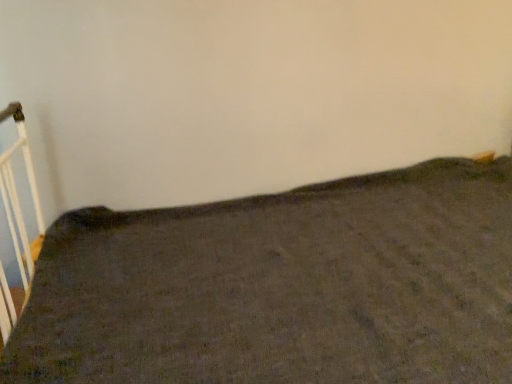
Measure the distance between point (29, 354) and camera.

Point (29, 354) and camera are 33.07 inches apart from each other.

At what (x,y) coordinates should I click in order to perform the action: click on dark fabric bed at center. Please return your answer as a coordinate pair (x, y). This screenshot has height=384, width=512. Looking at the image, I should click on (282, 287).

Describe the element at coordinates (282, 287) in the screenshot. Image resolution: width=512 pixels, height=384 pixels. I see `dark fabric bed at center` at that location.

Find the location of a particular element. dark fabric bed at center is located at coordinates (282, 287).